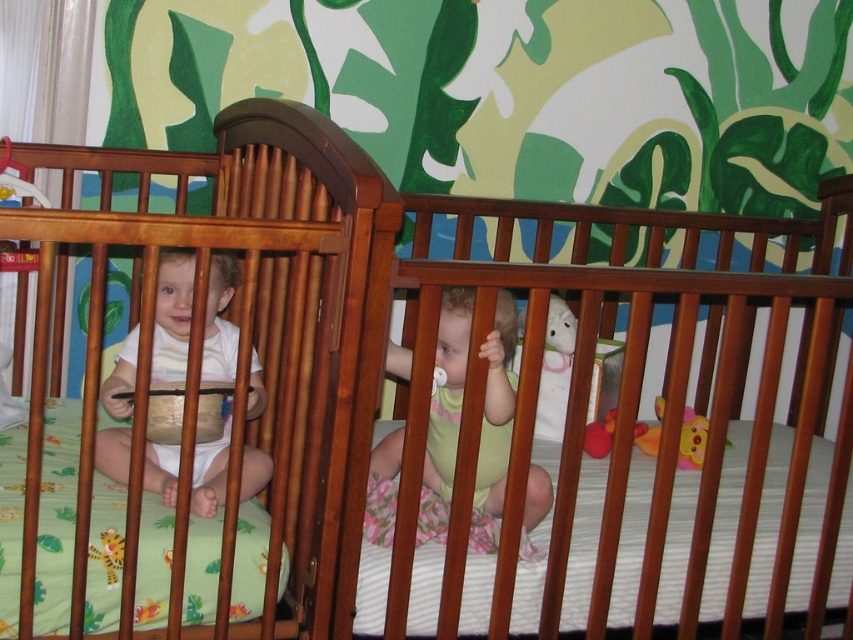
Question: Which point is closer to the camera taking this photo?

Choices:
 (A) (218, 252)
 (B) (445, 358)
 (C) (218, 244)
 (D) (590, 438)

Answer: (C)

Question: Is white matte baby at left thinner than soft plush toy at center?

Choices:
 (A) yes
 (B) no

Answer: (B)

Question: Considering the relative positions of white matte baby at left and yellow cotton onesie at center in the image provided, where is white matte baby at left located with respect to yellow cotton onesie at center?

Choices:
 (A) left
 (B) right

Answer: (A)

Question: From the image, what is the correct spatial relationship of wooden crib at center in relation to yellow cotton onesie at center?

Choices:
 (A) left
 (B) right

Answer: (A)

Question: Which point is closer to the camera?

Choices:
 (A) (688, 449)
 (B) (496, 355)
 (C) (596, 438)
 (D) (173, 380)

Answer: (B)

Question: Among these points, which one is nearest to the camera?

Choices:
 (A) (527, 472)
 (B) (347, 348)
 (C) (677, 460)
 (D) (161, 378)

Answer: (B)